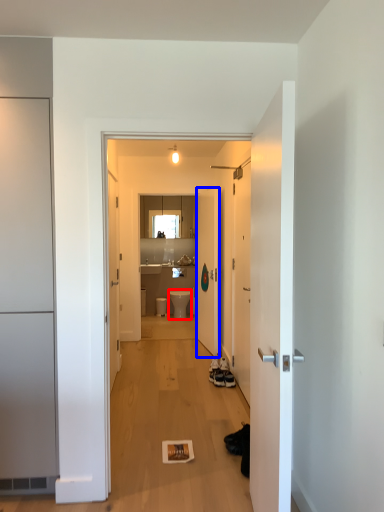
Question: Which of the following is the farthest to the observer, toilet (highlighted by a red box) or door (highlighted by a blue box)?

Choices:
 (A) toilet
 (B) door

Answer: (A)